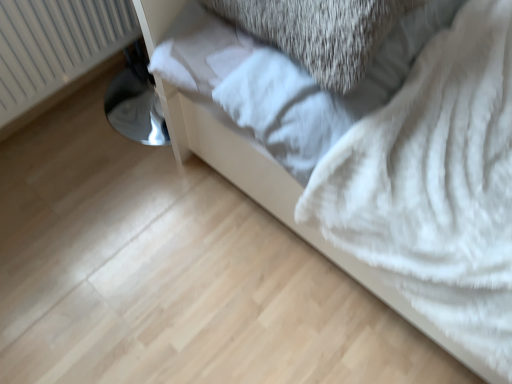
Question: Can you confirm if white fluffy sheet at center is positioned to the left of white fluffy blanket at lower right?

Choices:
 (A) yes
 (B) no

Answer: (A)

Question: From the image's perspective, is white fluffy sheet at center located above white fluffy blanket at lower right?

Choices:
 (A) yes
 (B) no

Answer: (A)

Question: Is there a large distance between white fluffy sheet at center and white fluffy blanket at lower right?

Choices:
 (A) yes
 (B) no

Answer: (B)

Question: Does white fluffy sheet at center have a larger size compared to white fluffy blanket at lower right?

Choices:
 (A) yes
 (B) no

Answer: (B)

Question: Is white fluffy sheet at center facing away from white fluffy blanket at lower right?

Choices:
 (A) yes
 (B) no

Answer: (A)

Question: From a real-world perspective, relative to white fluffy blanket at lower right, is white fluffy sheet at center vertically above or below?

Choices:
 (A) above
 (B) below

Answer: (A)

Question: Considering the positions of point (194, 74) and point (282, 180), is point (194, 74) closer or farther from the camera than point (282, 180)?

Choices:
 (A) closer
 (B) farther

Answer: (A)

Question: From the image's perspective, is white fluffy sheet at center above or below white fluffy blanket at lower right?

Choices:
 (A) below
 (B) above

Answer: (B)

Question: Is white fluffy sheet at center situated inside white fluffy blanket at lower right or outside?

Choices:
 (A) outside
 (B) inside

Answer: (B)

Question: Considering their positions, is white plastic radiator at left located in front of or behind white fluffy sheet at center?

Choices:
 (A) behind
 (B) front

Answer: (A)

Question: Is white plastic radiator at left wider or thinner than white fluffy sheet at center?

Choices:
 (A) thin
 (B) wide

Answer: (B)

Question: Looking at the image, does white plastic radiator at left seem bigger or smaller compared to white fluffy sheet at center?

Choices:
 (A) small
 (B) big

Answer: (A)

Question: From a real-world perspective, is white plastic radiator at left physically located above or below white fluffy sheet at center?

Choices:
 (A) below
 (B) above

Answer: (A)

Question: From a real-world perspective, is white plastic radiator at left positioned above or below white fluffy blanket at lower right?

Choices:
 (A) below
 (B) above

Answer: (A)

Question: Is point (74, 1) closer or farther from the camera than point (223, 155)?

Choices:
 (A) farther
 (B) closer

Answer: (A)